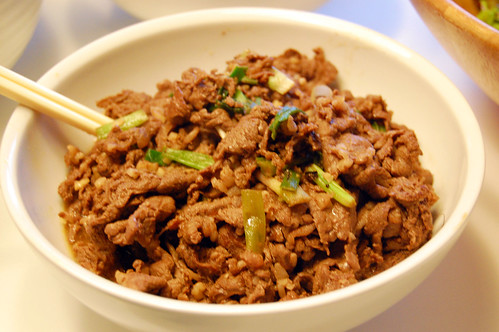
Identify the location of bowl. This screenshot has height=332, width=499. (160, 48), (358, 305).